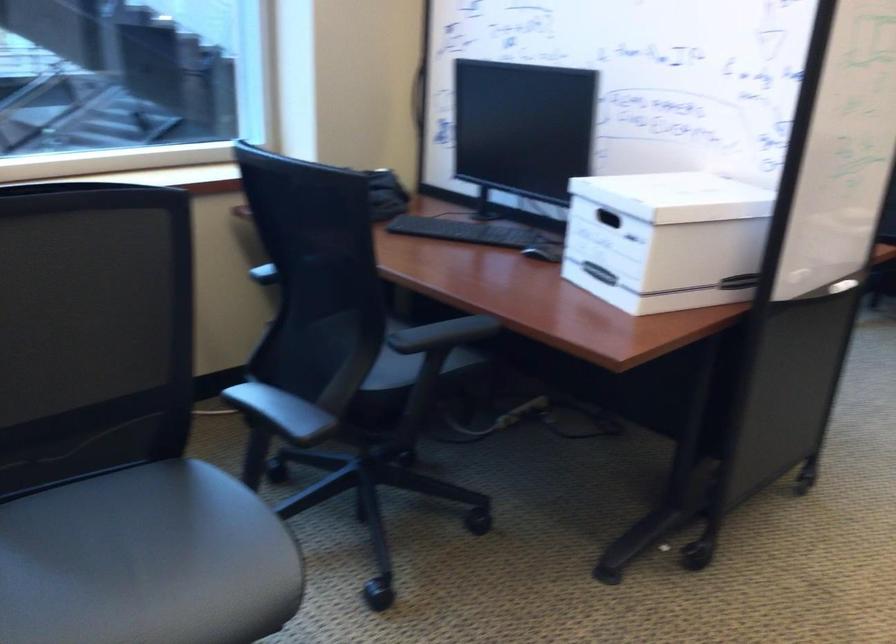
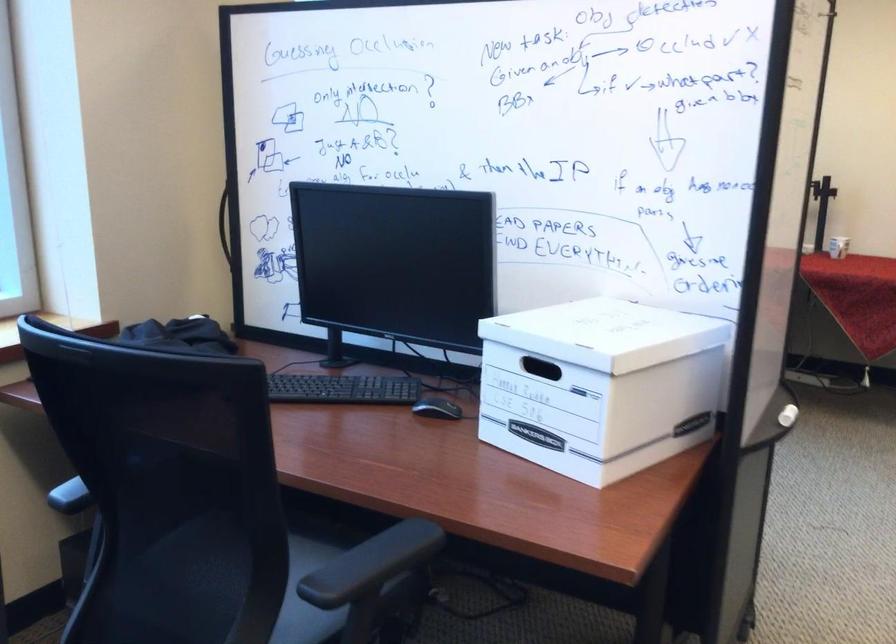
Question: The camera is either moving clockwise (left) or counter-clockwise (right) around the object. The first image is from the beginning of the video and the second image is from the end. Is the camera moving left or right when shooting the video?

Choices:
 (A) Left
 (B) Right

Answer: (A)